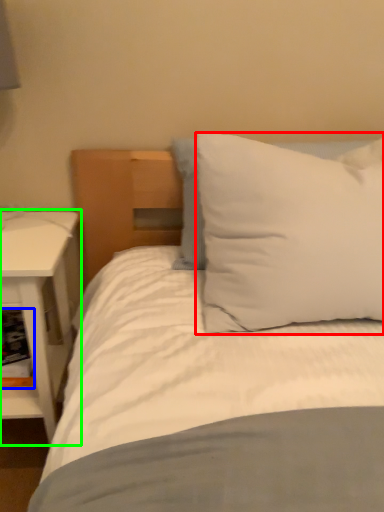
Question: Which is farther away from pillow (highlighted by a red box)? shelf (highlighted by a blue box) or nightstand (highlighted by a green box)?

Choices:
 (A) shelf
 (B) nightstand

Answer: (A)